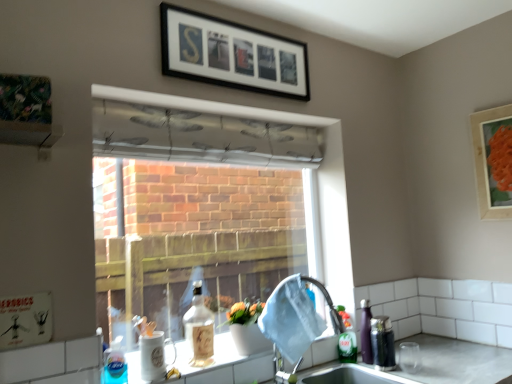
Question: Is satin nickel faucet at sink right placed right next to black matte picture frame at upper center, which ranks as the first picture frame in left-to-right order?

Choices:
 (A) yes
 (B) no

Answer: (B)

Question: Does satin nickel faucet at sink right have a larger size compared to black matte picture frame at upper center, the second picture frame in the bottom-to-top sequence?

Choices:
 (A) yes
 (B) no

Answer: (B)

Question: Is satin nickel faucet at sink right to the right of black matte picture frame at upper center, positioned as the 1th picture frame in top-to-bottom order, from the viewer's perspective?

Choices:
 (A) no
 (B) yes

Answer: (B)

Question: From a real-world perspective, is satin nickel faucet at sink right positioned under black matte picture frame at upper center, the 2th picture frame from the right, based on gravity?

Choices:
 (A) no
 (B) yes

Answer: (B)

Question: Does satin nickel faucet at sink right have a lesser height compared to black matte picture frame at upper center, positioned as the 1th picture frame in top-to-bottom order?

Choices:
 (A) yes
 (B) no

Answer: (B)

Question: Is black matte picture frame at upper center, which ranks as the first picture frame in left-to-right order, at the back of satin nickel faucet at sink right?

Choices:
 (A) no
 (B) yes

Answer: (A)

Question: Is green matte bottle at sink right, placed as the first bottle when sorted from back to front, outside transparent fabric at center?

Choices:
 (A) yes
 (B) no

Answer: (A)

Question: Is green matte bottle at sink right, positioned as the 1th bottle in right-to-left order, turned away from transparent fabric at center?

Choices:
 (A) yes
 (B) no

Answer: (A)

Question: Can you confirm if green matte bottle at sink right, the third bottle when ordered from front to back, is smaller than transparent fabric at center?

Choices:
 (A) yes
 (B) no

Answer: (A)

Question: From the image's perspective, would you say green matte bottle at sink right, the third bottle when ordered from front to back, is shown under transparent fabric at center?

Choices:
 (A) no
 (B) yes

Answer: (B)

Question: Is green matte bottle at sink right, the third bottle positioned from the left, bigger than transparent fabric at center?

Choices:
 (A) no
 (B) yes

Answer: (A)

Question: Can you confirm if green matte bottle at sink right, placed as the first bottle when sorted from back to front, is positioned to the right of transparent fabric at center?

Choices:
 (A) yes
 (B) no

Answer: (A)

Question: Considering the relative sizes of matte wooden picture frame at upper right, marked as the 1th picture frame in a right-to-left arrangement, and translucent plastic bottle at lower left, placed as the first bottle when sorted from front to back, in the image provided, is matte wooden picture frame at upper right, marked as the 1th picture frame in a right-to-left arrangement, wider than translucent plastic bottle at lower left, placed as the first bottle when sorted from front to back,?

Choices:
 (A) yes
 (B) no

Answer: (B)